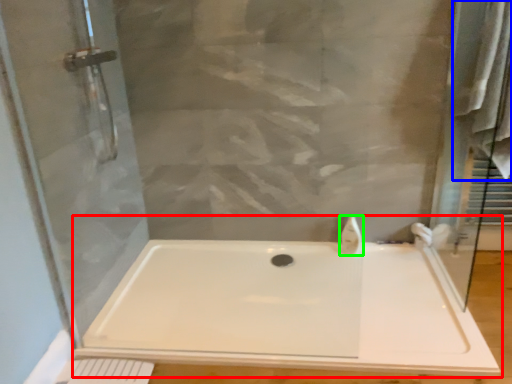
Question: Which object is the farthest from bathtub (highlighted by a red box)? Choose among these: bath towel (highlighted by a blue box) or faucet (highlighted by a green box).

Choices:
 (A) bath towel
 (B) faucet

Answer: (A)